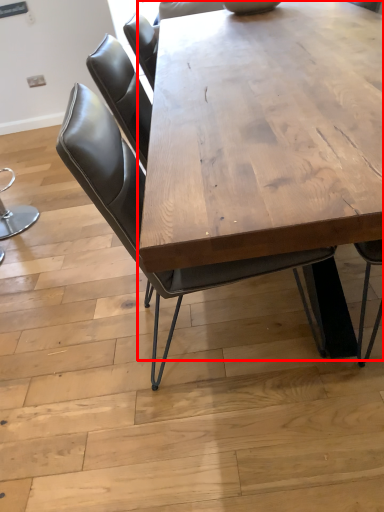
Question: In this image, where is coffee table (annotated by the red box) located relative to chair?

Choices:
 (A) left
 (B) right

Answer: (B)